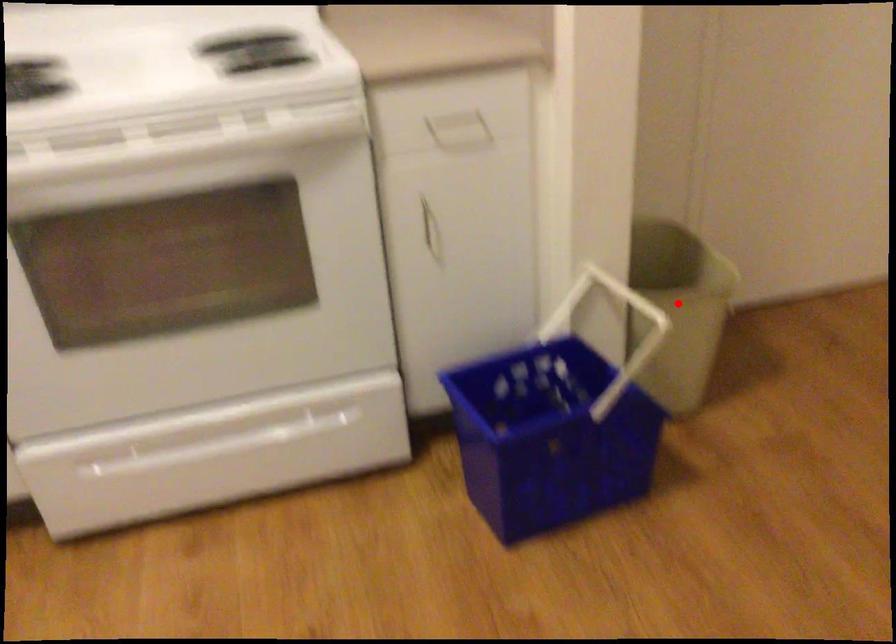
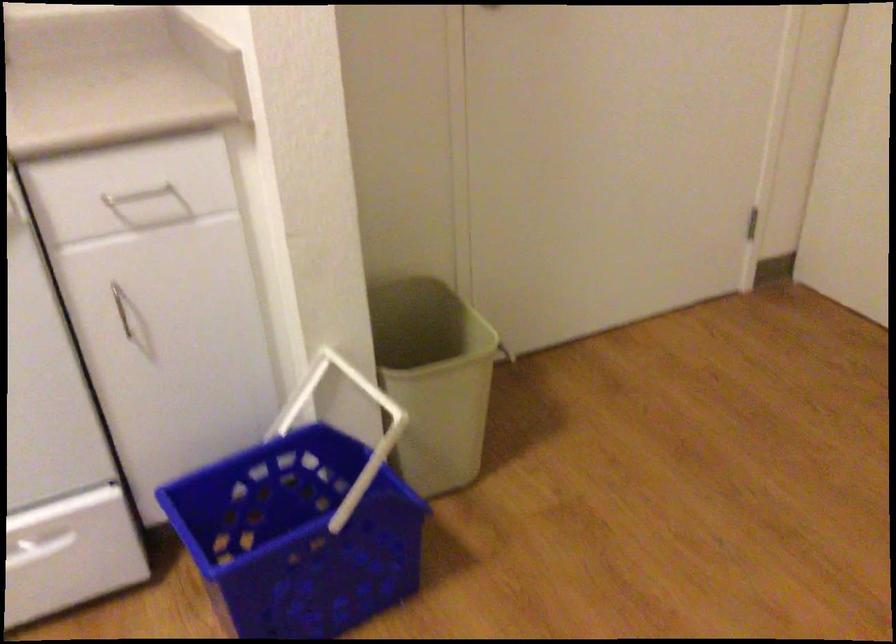
The point at the highlighted location is marked in the first image. Where is the corresponding point in the second image?

(434, 379)